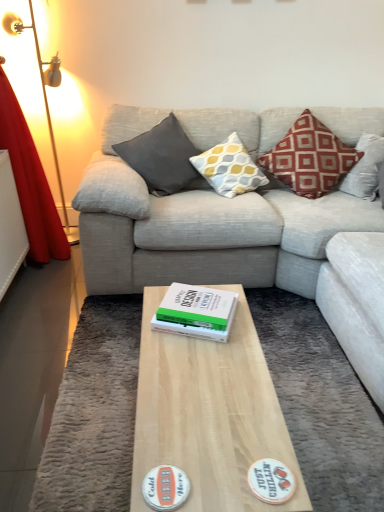
You are a GUI agent. You are given a task and a screenshot of the screen. Output one action in this format:
    pyautogui.click(x=<x>, y=<y>)
    Task: Click on the vacant space that is in between matte white coaster at lower center, which ranks as the 2th sticker in right-to-left order, and white matte sticker at center, the second sticker in the left-to-right sequence
    
    Given the screenshot: What is the action you would take?
    pyautogui.click(x=223, y=480)